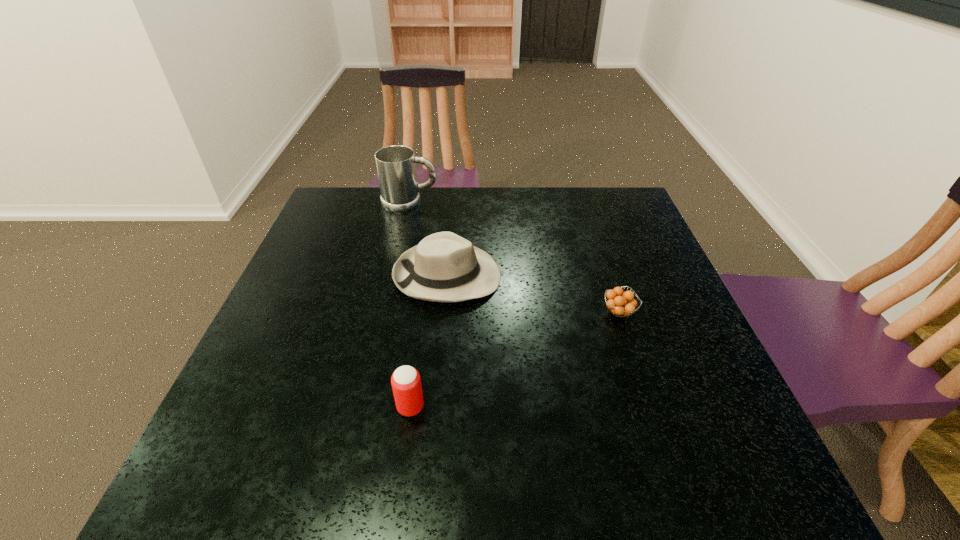
Where is `mug`? This screenshot has height=540, width=960. mug is located at coordinates (396, 168).

Where is `the tallest object`? The width and height of the screenshot is (960, 540). the tallest object is located at coordinates (396, 168).

You are a GUI agent. You are given a task and a screenshot of the screen. Output one action in this format:
    pyautogui.click(x=<x>, y=<y>)
    Task: Click on the fedora
    The width and height of the screenshot is (960, 540).
    Given the screenshot: What is the action you would take?
    pyautogui.click(x=444, y=267)

Identify the location of the nearest object. Image resolution: width=960 pixels, height=540 pixels. (406, 383).

This screenshot has height=540, width=960. Identify the location of the shortest object. (621, 304).

Image resolution: width=960 pixels, height=540 pixels. I want to click on the rightmost object, so click(x=621, y=304).

The image size is (960, 540). I want to click on vacant space located on the side of the farthest object with the handle, so click(534, 204).

Where is `vacant space located 0.270m on the front-facing side of the fedora`? The height and width of the screenshot is (540, 960). vacant space located 0.270m on the front-facing side of the fedora is located at coordinates (608, 276).

Where is `free point located 0.250m on the right of the beer can`? free point located 0.250m on the right of the beer can is located at coordinates point(557,407).

The width and height of the screenshot is (960, 540). I want to click on vacant area located on the back of the orange fruit, so pyautogui.click(x=600, y=254).